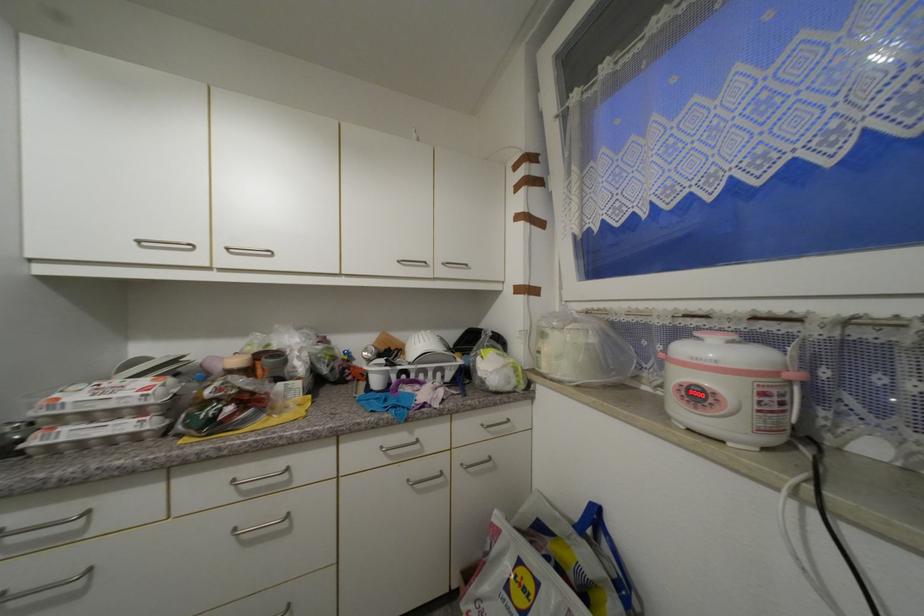
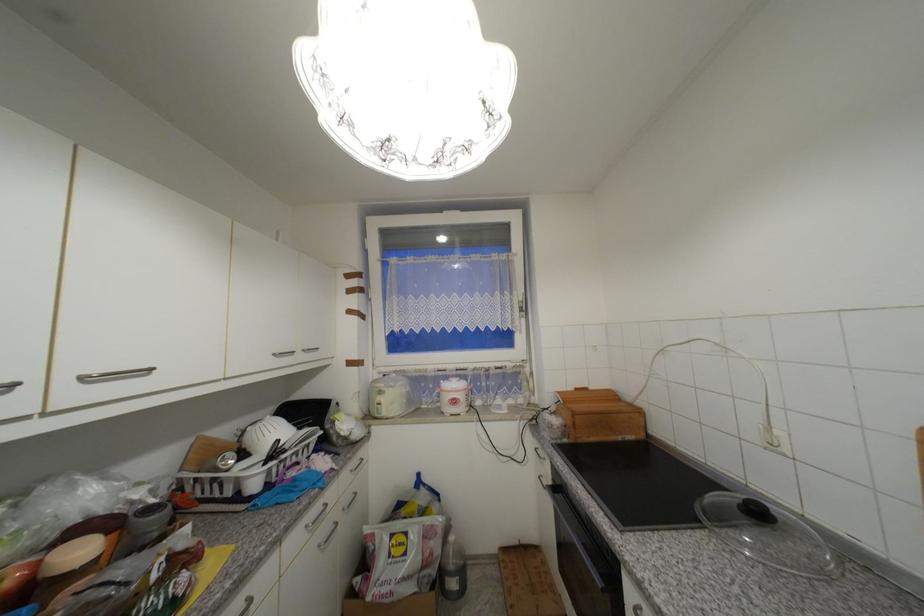
In the second image, find the point that corresponds to pixel 234 251 in the first image.

(89, 379)